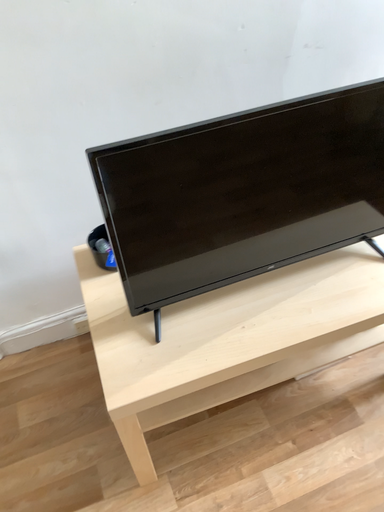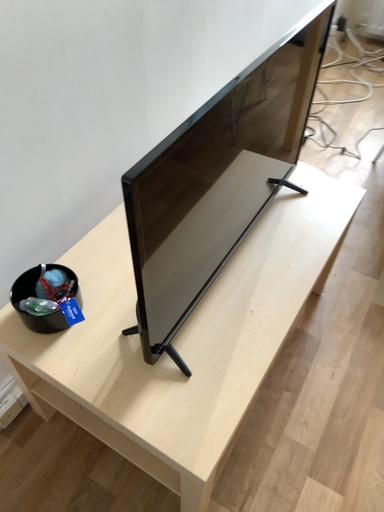
Question: Which way did the camera rotate in the video?

Choices:
 (A) rotated left
 (B) rotated right

Answer: (B)